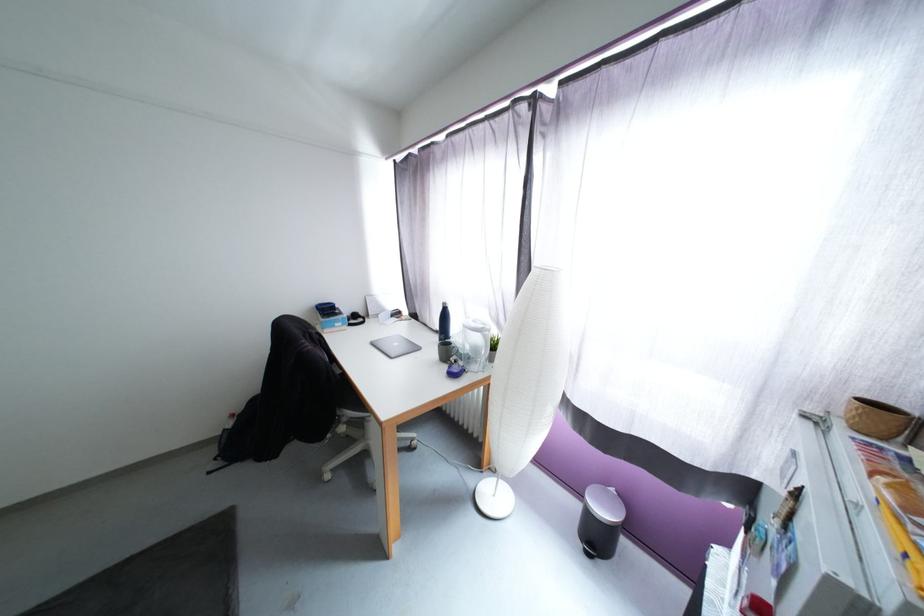
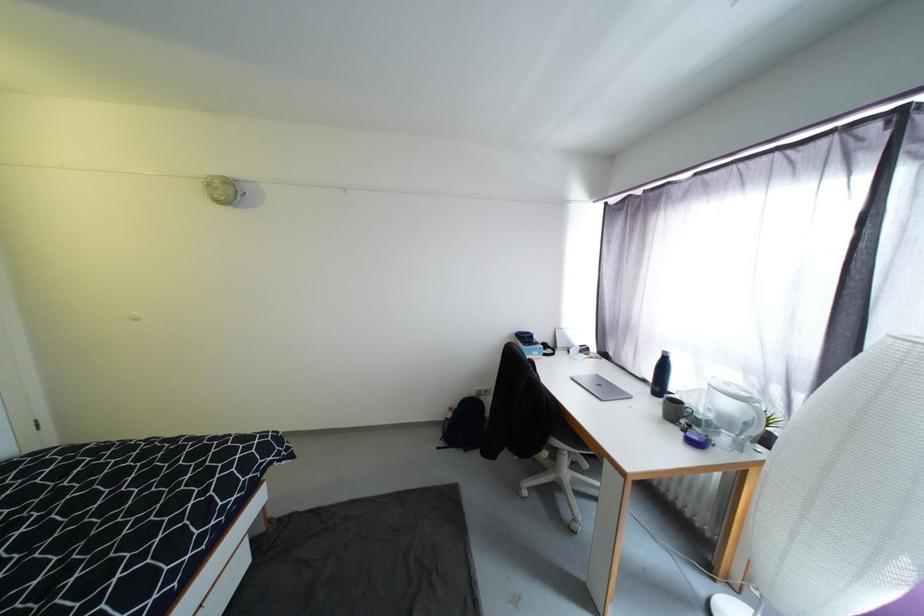
In the second image, find the point that corresponds to pixel 460 363 in the first image.

(696, 427)